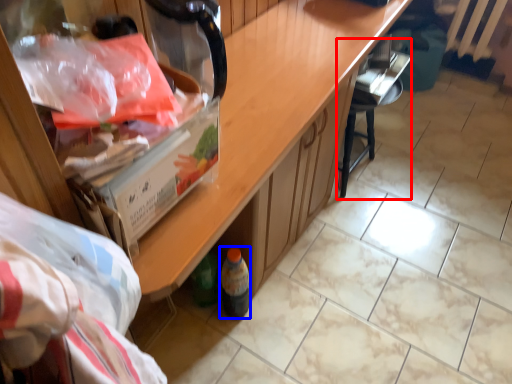
Question: Which object appears closest to the camera in this image, chair (highlighted by a red box) or wine bottle (highlighted by a blue box)?

Choices:
 (A) chair
 (B) wine bottle

Answer: (B)